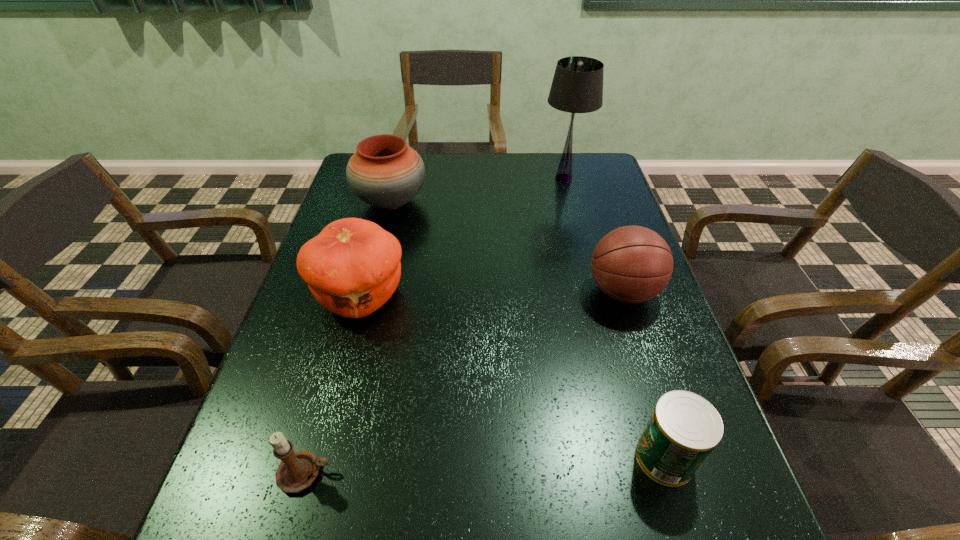
In order to click on vacant area situated on the right of the pottery in this screenshot , I will do `click(539, 202)`.

This screenshot has width=960, height=540. I want to click on vacant region located on the back of the basketball, so click(x=596, y=211).

The image size is (960, 540). Identify the location of free spot located on the back of the can. (624, 324).

Find the location of a particular element. This screenshot has height=540, width=960. free space located 0.400m on the side of the candle holder with the handle is located at coordinates (561, 473).

Find the location of `lampshade that is at the far edge`. lampshade that is at the far edge is located at coordinates (577, 87).

What are the coordinates of `pottery that is at the far edge` in the screenshot? It's located at (384, 172).

At what (x,y) coordinates should I click in order to perform the action: click on pumpkin at the left edge. Please return your answer as a coordinate pair (x, y). Looking at the image, I should click on (352, 268).

The image size is (960, 540). Find the location of `pottery present at the left edge`. pottery present at the left edge is located at coordinates click(384, 172).

This screenshot has width=960, height=540. Identify the location of candle holder positioned at the left edge. (297, 470).

This screenshot has width=960, height=540. Find the location of `lampshade situated at the right edge`. lampshade situated at the right edge is located at coordinates (577, 87).